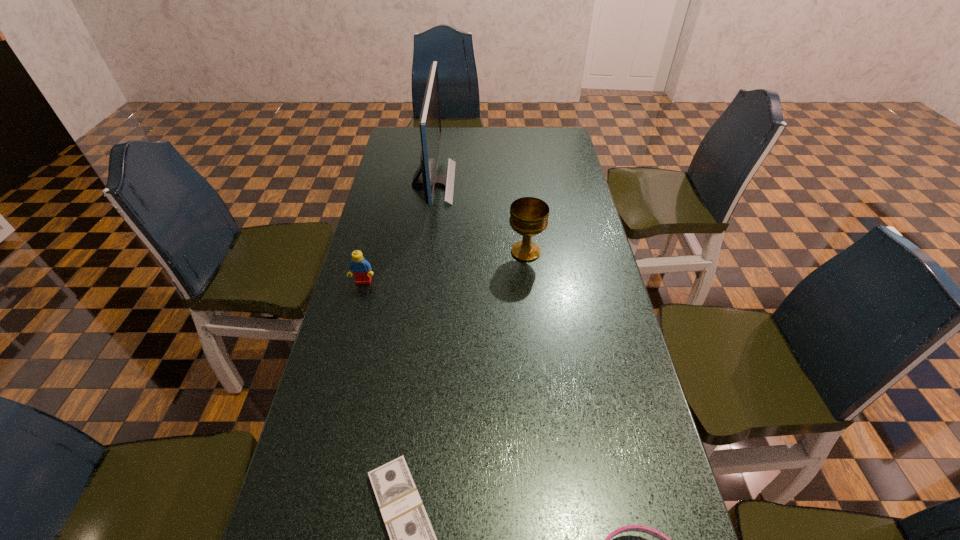
Locate an element on the screen. vacant region that satisfies the following two spatial constraints: 1. on the screen side of the tallest object; 2. on the right side of the chalice is located at coordinates (424, 252).